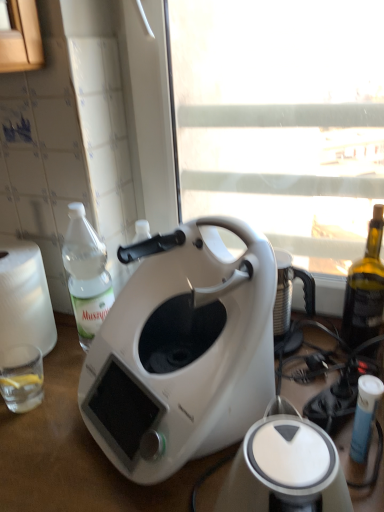
Locate an element on the screen. The image size is (384, 512). free space to the back side of clear glass at lower left is located at coordinates (58, 365).